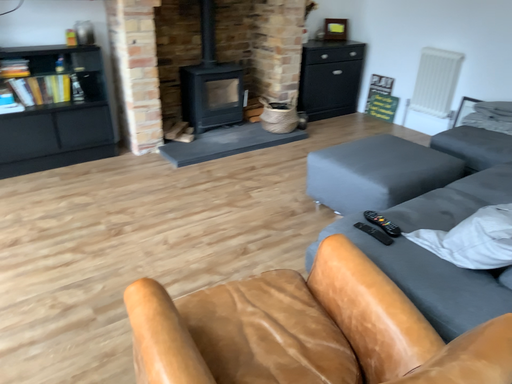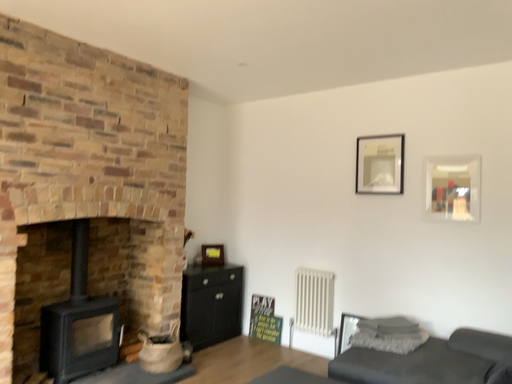
Question: How did the camera likely rotate when shooting the video?

Choices:
 (A) rotated upward
 (B) rotated downward

Answer: (A)